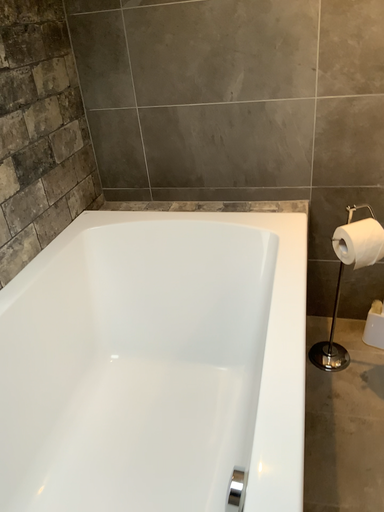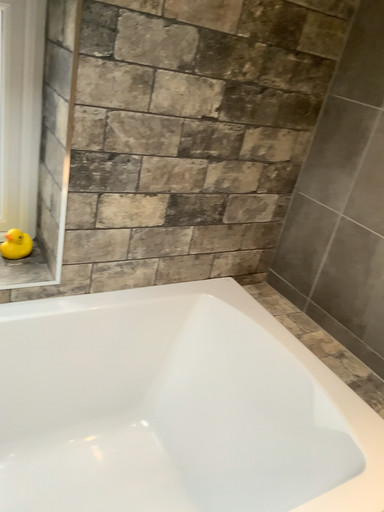
Question: Which way did the camera rotate in the video?

Choices:
 (A) rotated downward
 (B) rotated upward

Answer: (B)